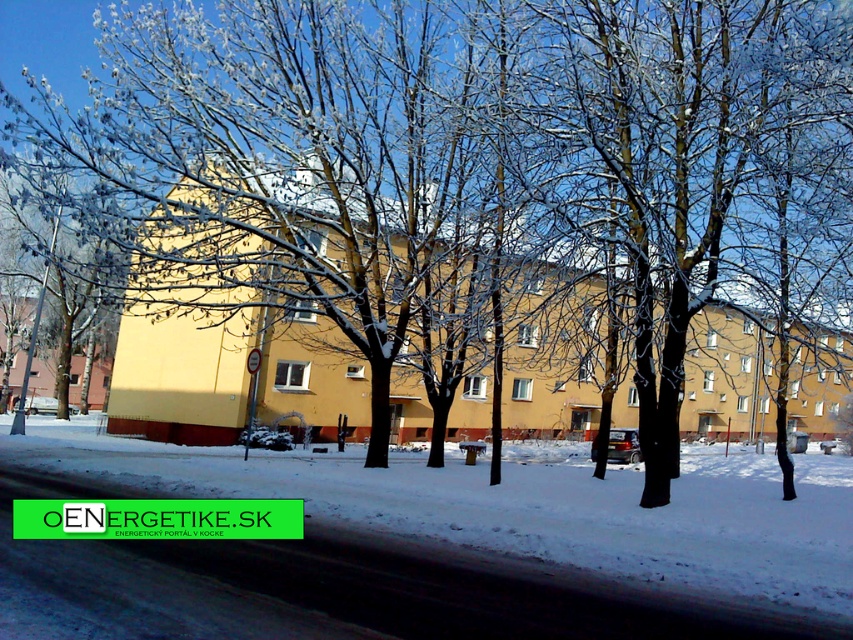
Question: Is white powdery snow at center to the left of white frosty tree at left from the viewer's perspective?

Choices:
 (A) yes
 (B) no

Answer: (B)

Question: Which point is closer to the camera?

Choices:
 (A) white frosty tree at left
 (B) white powdery snow at center

Answer: (B)

Question: Which point is closer to the camera?

Choices:
 (A) white powdery snow at center
 (B) white frosty tree at left

Answer: (A)

Question: Which point is closer to the camera taking this photo?

Choices:
 (A) (55, 356)
 (B) (457, 492)

Answer: (B)

Question: Does white powdery snow at center appear over white frosty tree at left?

Choices:
 (A) yes
 (B) no

Answer: (B)

Question: Is white powdery snow at center above white frosty tree at left?

Choices:
 (A) yes
 (B) no

Answer: (B)